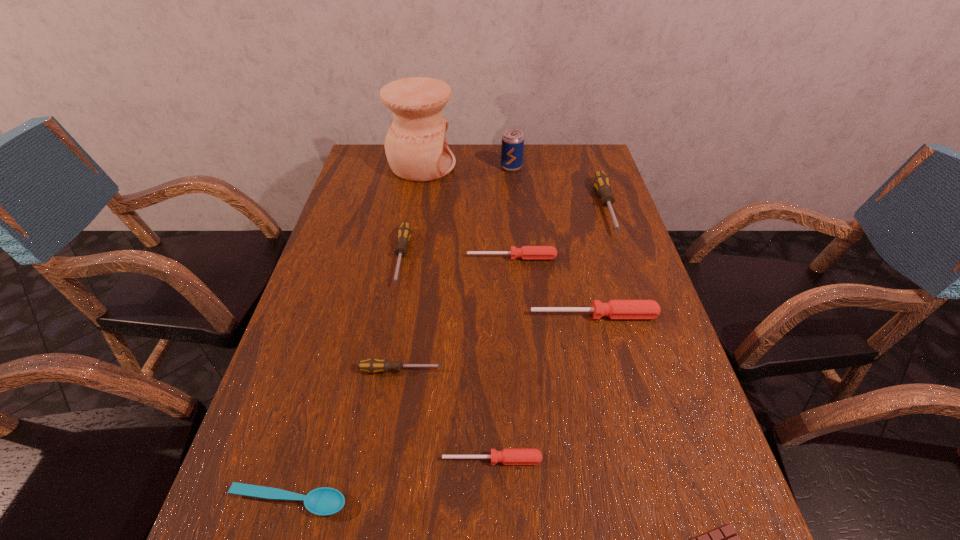
The height and width of the screenshot is (540, 960). In order to click on the tallest object in this screenshot , I will do `click(416, 148)`.

Where is `cream pottery`? The image size is (960, 540). cream pottery is located at coordinates (416, 148).

The width and height of the screenshot is (960, 540). I want to click on the second tallest object, so 512,140.

This screenshot has width=960, height=540. What are the coordinates of `the tallest screwdriver` in the screenshot? It's located at (601, 182).

Find the location of a particular element. Image resolution: width=960 pixels, height=540 pixels. the biggest gray screwdriver is located at coordinates (601, 182).

Where is `the second smallest gray screwdriver`? Image resolution: width=960 pixels, height=540 pixels. the second smallest gray screwdriver is located at coordinates (404, 233).

The width and height of the screenshot is (960, 540). Find the location of `the biggest red screwdriver`. the biggest red screwdriver is located at coordinates (614, 309).

The width and height of the screenshot is (960, 540). In order to click on the second nearest red screwdriver in this screenshot , I will do `click(614, 309)`.

The height and width of the screenshot is (540, 960). I want to click on the farthest red screwdriver, so click(525, 252).

You are a GUI agent. You are given a task and a screenshot of the screen. Output one action in this format:
    pyautogui.click(x=<x>, y=<y>)
    Task: Click on the second nearest screwdriver
    
    Given the screenshot: What is the action you would take?
    pyautogui.click(x=373, y=365)